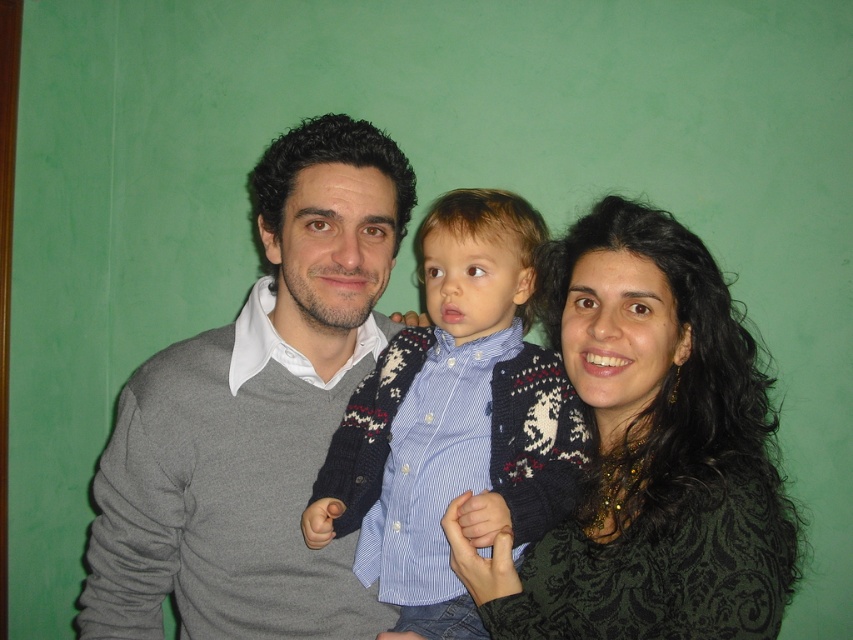
I want to click on black textured sweater at center, so click(651, 451).

Is point (697, 509) positioned after point (624, 525)?

That is False.

Who is more distant from viewer, (689, 332) or (267, 180)?

Point (267, 180)

Where is `black textured sweater at center`? This screenshot has width=853, height=640. black textured sweater at center is located at coordinates coord(651,451).

Who is shorter, black textured sweater at center or blue striped shirt at center?

black textured sweater at center

Is black textured sweater at center bigger than blue striped shirt at center?

Indeed, black textured sweater at center has a larger size compared to blue striped shirt at center.

At what (x,y) coordinates should I click in order to perform the action: click on black textured sweater at center. Please return your answer as a coordinate pair (x, y). Image resolution: width=853 pixels, height=640 pixels. Looking at the image, I should click on (651, 451).

This screenshot has width=853, height=640. I want to click on black textured sweater at center, so click(x=651, y=451).

Can you confirm if gray sweater at center is taller than black textured sweater at center?

Correct, gray sweater at center is much taller as black textured sweater at center.

Based on the photo, can you confirm if gray sweater at center is thinner than black textured sweater at center?

Incorrect, gray sweater at center's width is not less than black textured sweater at center's.

Is point (131, 483) behind point (550, 275)?

No, (131, 483) is closer to viewer.

In order to click on gray sweater at center in this screenshot , I will do `click(254, 416)`.